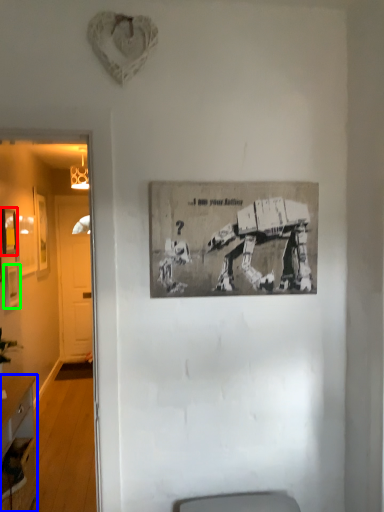
Question: Which object is the closest to the picture frame (highlighted by a red box)? Choose among these: desk (highlighted by a blue box) or picture frame (highlighted by a green box).

Choices:
 (A) desk
 (B) picture frame

Answer: (B)